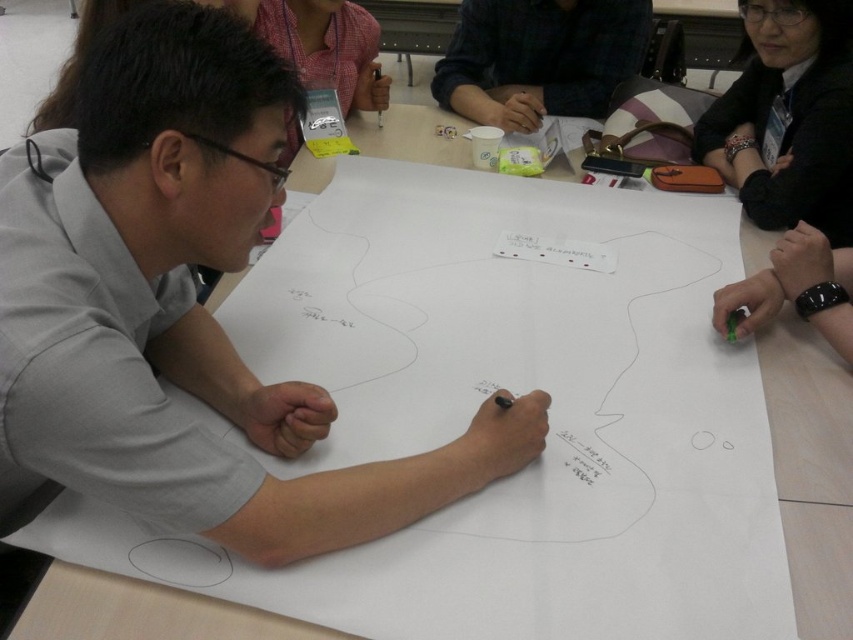
Question: Considering the relative positions of black leather jacket at upper right and dark plaid shirt at upper center in the image provided, where is black leather jacket at upper right located with respect to dark plaid shirt at upper center?

Choices:
 (A) above
 (B) below

Answer: (B)

Question: Which object is farther from the camera taking this photo?

Choices:
 (A) dark plaid shirt at upper center
 (B) black leather jacket at upper right

Answer: (A)

Question: Which point is farther from the camera taking this photo?

Choices:
 (A) (564, 35)
 (B) (740, 173)

Answer: (A)

Question: Does black leather jacket at upper right have a larger size compared to dark plaid shirt at upper center?

Choices:
 (A) no
 (B) yes

Answer: (A)

Question: Can you confirm if black leather jacket at upper right is positioned below dark plaid shirt at upper center?

Choices:
 (A) yes
 (B) no

Answer: (A)

Question: Which of the following is the closest to the observer?

Choices:
 (A) black leather jacket at upper right
 (B) dark plaid shirt at upper center

Answer: (A)